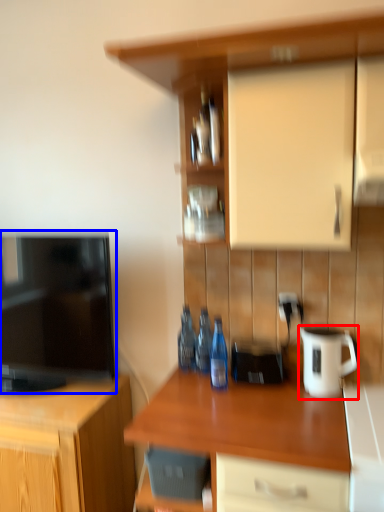
Question: Among these objects, which one is farthest to the camera, jug (highlighted by a red box) or television (highlighted by a blue box)?

Choices:
 (A) jug
 (B) television

Answer: (B)